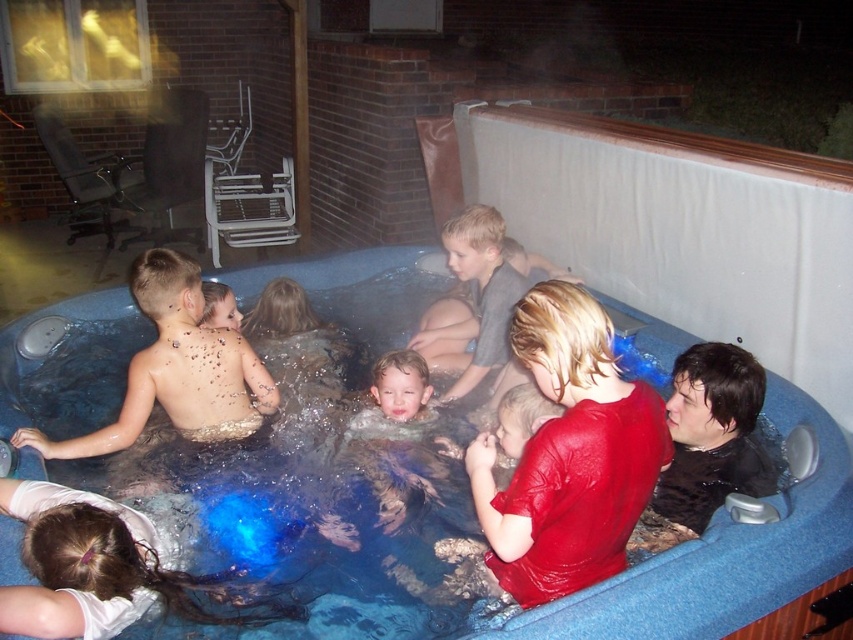
Question: Can you confirm if white matte hair at lower left is thinner than gray cotton shirt at center?

Choices:
 (A) yes
 (B) no

Answer: (B)

Question: Does smooth red shirt at center have a larger size compared to black matte shirt at lower right?

Choices:
 (A) yes
 (B) no

Answer: (A)

Question: Does smooth red shirt at center lie behind white matte hair at lower left?

Choices:
 (A) yes
 (B) no

Answer: (B)

Question: Which point is closer to the camera?

Choices:
 (A) gray cotton shirt at center
 (B) white matte hair at lower left

Answer: (B)

Question: Which object appears closest to the camera in this image?

Choices:
 (A) blue plastic tub at center
 (B) smooth tan skin at left

Answer: (A)

Question: Among these objects, which one is farthest from the camera?

Choices:
 (A) gray cotton shirt at center
 (B) smooth red shirt at center
 (C) black matte shirt at lower right

Answer: (A)